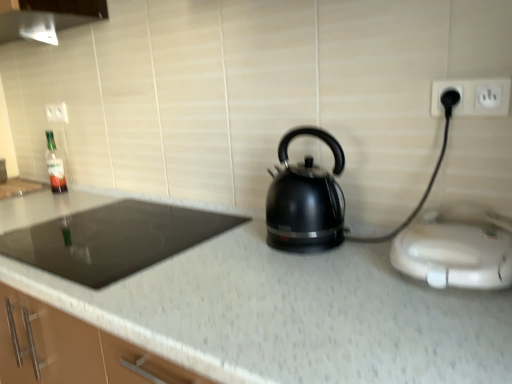
Find the location of a particular element. Image resolution: width=512 pixels, height=384 pixels. free space to the left of translucent glass bottle at left is located at coordinates (36, 193).